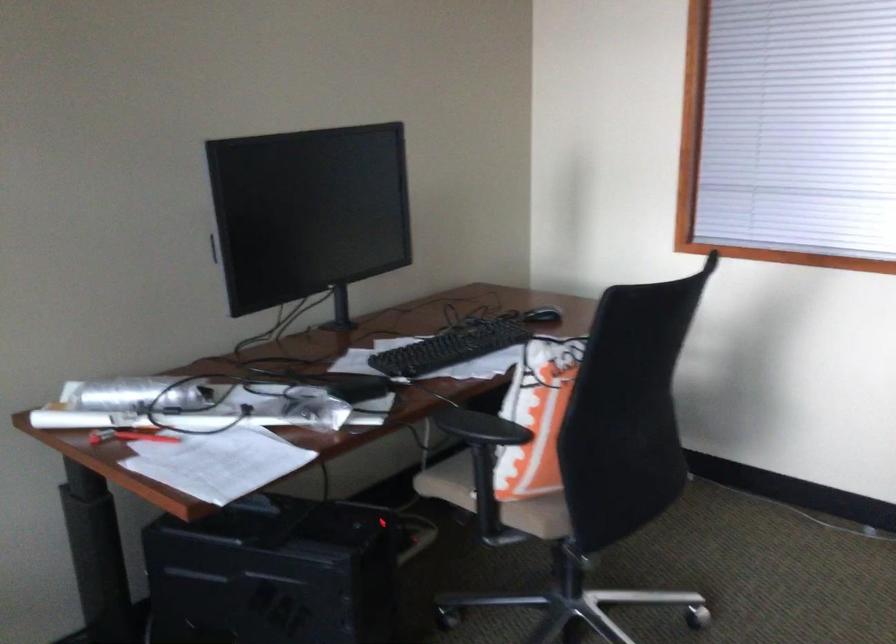
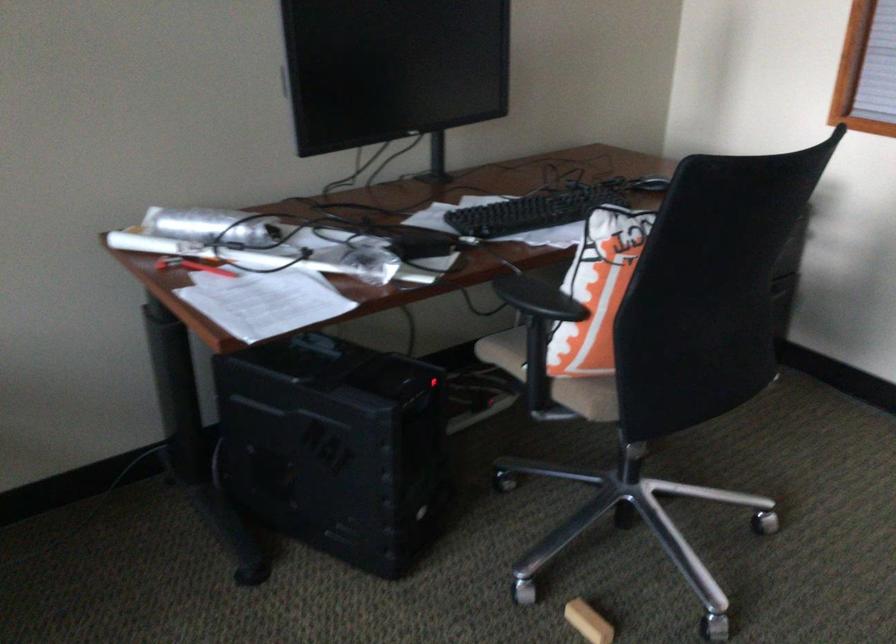
Where in the second image is the point corresponding to [503,503] from the first image?

(552, 377)